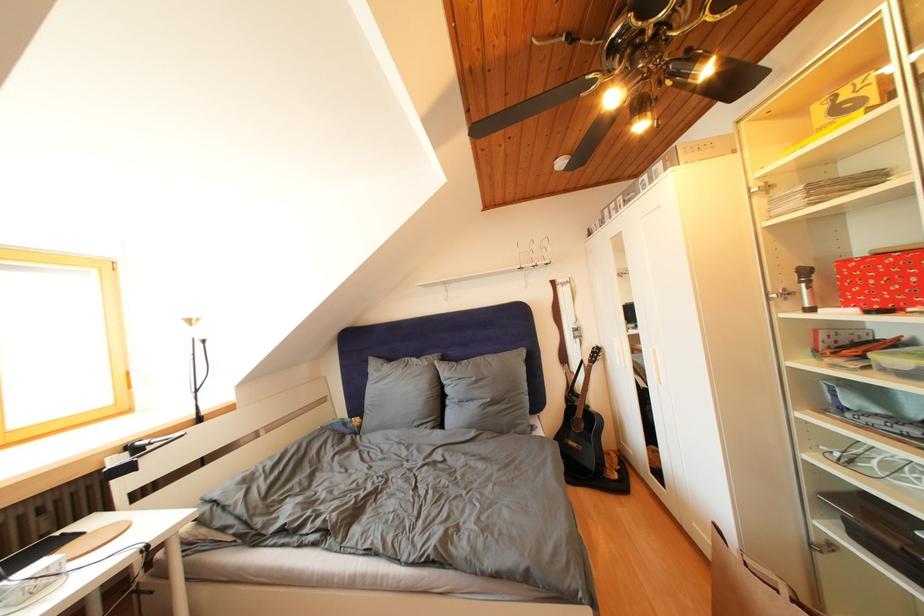
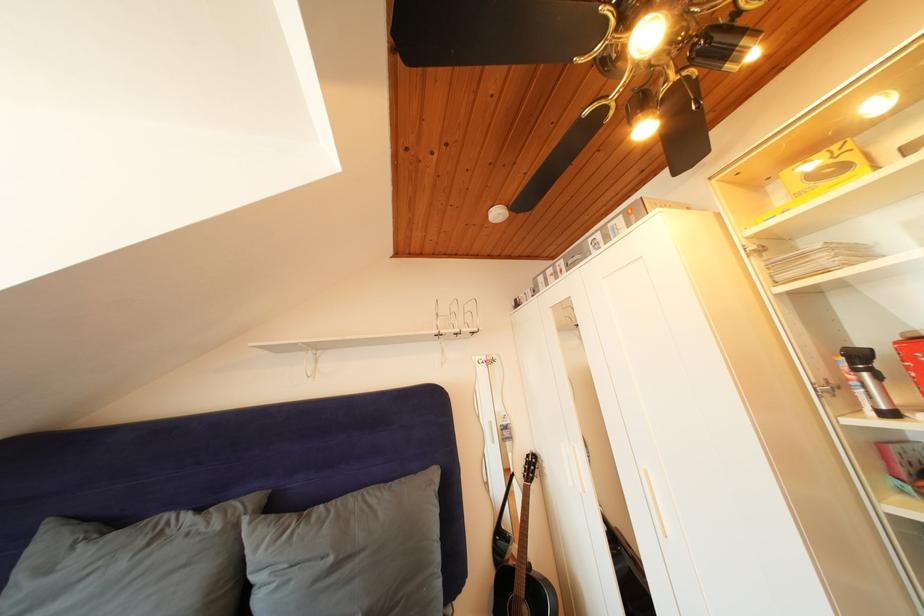
The point at (796, 300) is marked in the first image. Where is the corresponding point in the second image?

(844, 392)